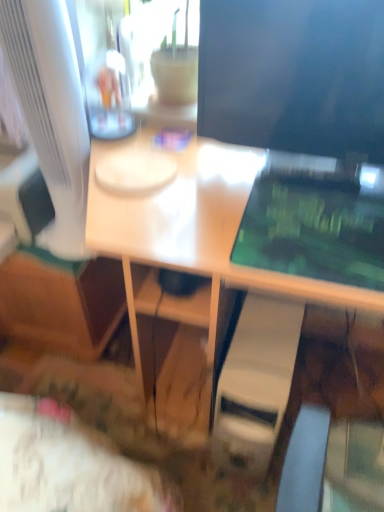
You are a GUI agent. You are given a task and a screenshot of the screen. Output one action in this format:
    pyautogui.click(x=<x>, y=<y>)
    Task: Click on the free space in front of matte black monitor at upper right, which appears as the first computer monitor when viewed from the right
    This screenshot has height=512, width=384.
    Given the screenshot: What is the action you would take?
    pyautogui.click(x=293, y=228)